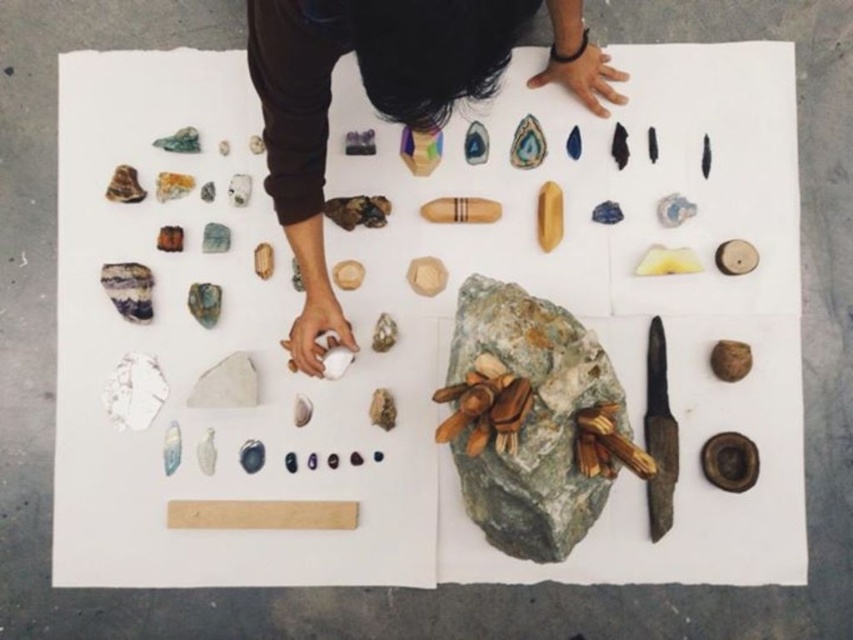
You are a geologist examining the arrangement of specimens on the white sheet. You notice the smooth brown hand at upper center and the green rough stone at center. Which object is positioned higher up in the image?

The smooth brown hand at upper center is positioned higher up in the image than the green rough stone at center.

You are a photographer positioned at the camera. You want to capture a closeup shot of the smooth brown hand at upper center. Considering its distance from the camera, can you estimate if you need to adjust your position to get a clear closeup?

The smooth brown hand at upper center is 33.81 inches away from the camera. To capture a clear closeup, you would need to move closer or use a zoom lens, as 33.81 inches may be too far for a standard closeup without additional adjustments.